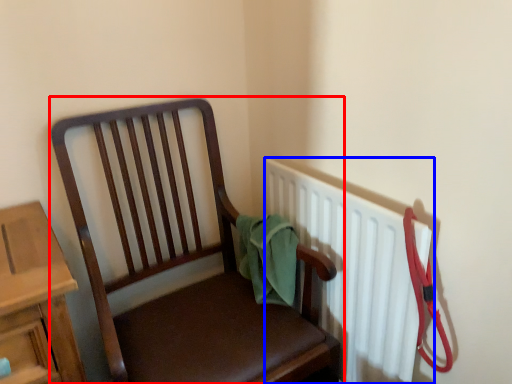
Question: Which point is further to the camera, chair (highlighted by a red box) or radiator (highlighted by a blue box)?

Choices:
 (A) chair
 (B) radiator

Answer: (B)